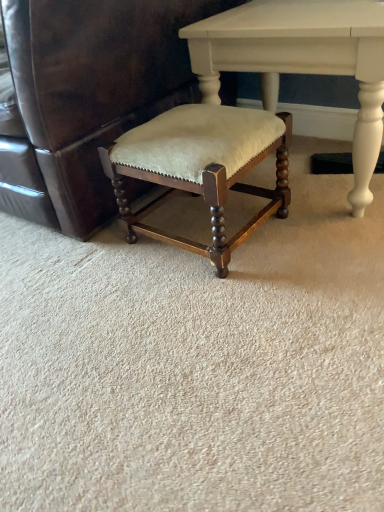
This screenshot has height=512, width=384. Find the location of `free location in front of velvet beige stool at center`. free location in front of velvet beige stool at center is located at coordinates (221, 305).